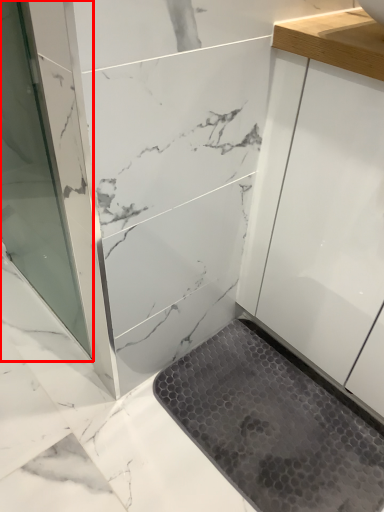
Question: Observing the image, what is the correct spatial positioning of screen door (annotated by the red box) in reference to bath mat?

Choices:
 (A) right
 (B) left

Answer: (B)